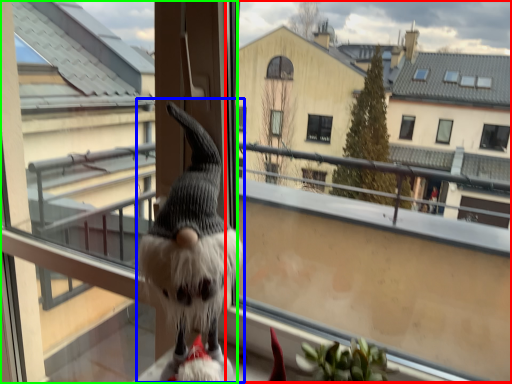
Question: Considering the real-world distances, which object is closest to window screen (highlighted by a red box)? animal (highlighted by a blue box) or screen door (highlighted by a green box).

Choices:
 (A) animal
 (B) screen door

Answer: (B)